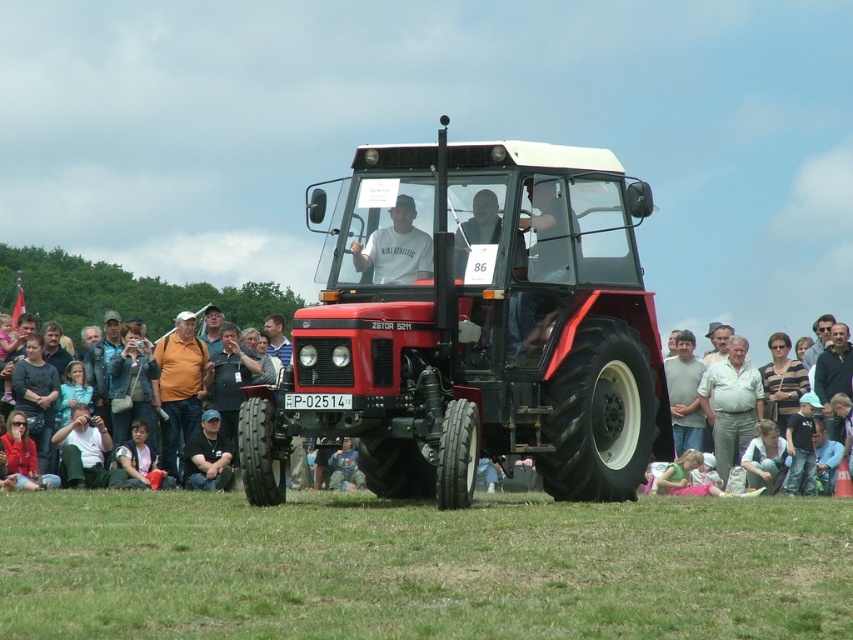
Based on the photo, measure the distance between light beige pants at center and camera.

They are 127.99 feet apart.

Is point (741, 410) positioned behind point (799, 369)?

That is False.

In order to click on light beige pants at center in this screenshot , I will do `click(730, 403)`.

Is green grass at lower center smaller than orange fabric shirt at center?

Incorrect, green grass at lower center is not smaller in size than orange fabric shirt at center.

Does green grass at lower center have a lesser width compared to orange fabric shirt at center?

Incorrect, green grass at lower center's width is not less than orange fabric shirt at center's.

Identify the location of green grass at lower center. The image size is (853, 640). (421, 566).

Is matte white shirt at center to the right of dark gray sweater at lower left from the viewer's perspective?

Correct, you'll find matte white shirt at center to the right of dark gray sweater at lower left.

What do you see at coordinates (395, 248) in the screenshot? The image size is (853, 640). I see `matte white shirt at center` at bounding box center [395, 248].

This screenshot has width=853, height=640. Find the location of `matte white shirt at center`. matte white shirt at center is located at coordinates (395, 248).